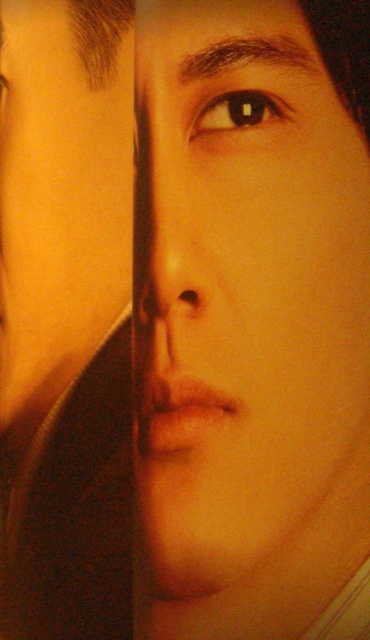
You are a photographer adjusting lighting for a portrait. You notice the smooth skin face at center and the brown glossy eye at upper center. Which object would appear wider in the photo?

The smooth skin face at center appears wider than the brown glossy eye at upper center because its width is larger.

You are a photographer adjusting lighting for a portrait. You notice the smooth skin face at center and the brown glossy eye at upper center. Which object is positioned higher in the image?

The brown glossy eye at upper center is positioned higher in the image than the smooth skin face at center.